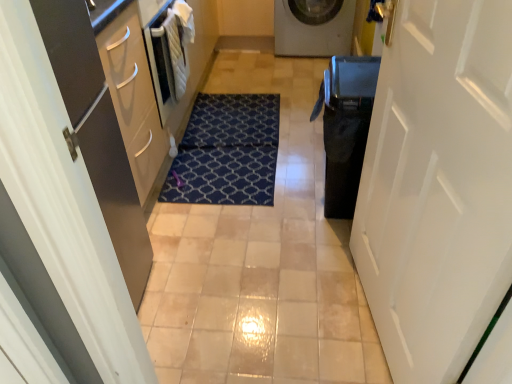
The width and height of the screenshot is (512, 384). Find the location of `vacant space situated on the left part of black glossy dishwasher at right`. vacant space situated on the left part of black glossy dishwasher at right is located at coordinates (285, 208).